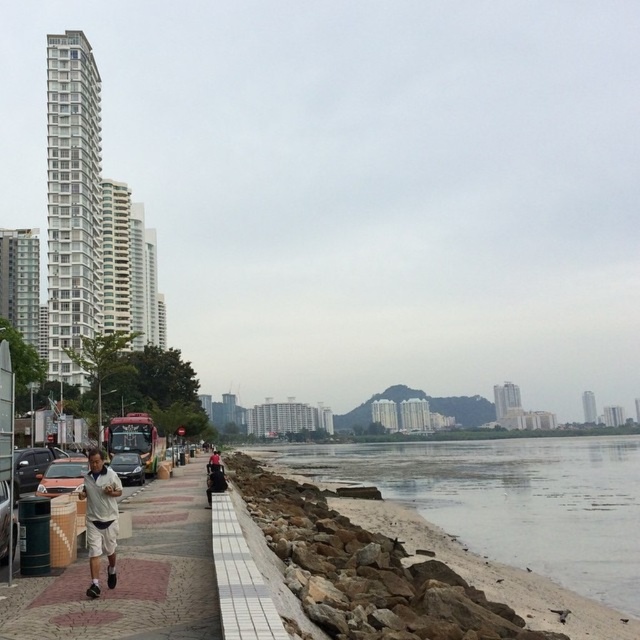
Based on the photo, you are standing at the lower edge of the image and want to place a small potted plant exactly at the white tile curb at lower center. According to the coordinates provided, what are the coordinates where you should place the potted plant?

The coordinates for the white tile curb at lower center are (241, 579), so you should place the potted plant at those coordinates.

You are standing on the paved walkway and want to take a photo of the gray rocky shore at lower left and the metallic silver car at left. Which object should you position to your right side to capture both in the frame?

You should position the metallic silver car at left to your right side because the gray rocky shore at lower left is to the right of the metallic silver car at left.